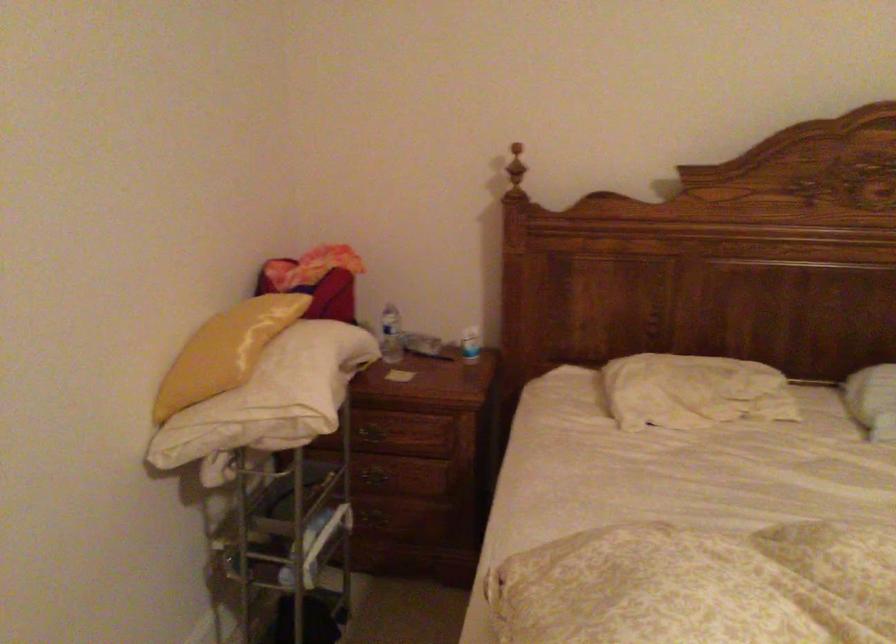
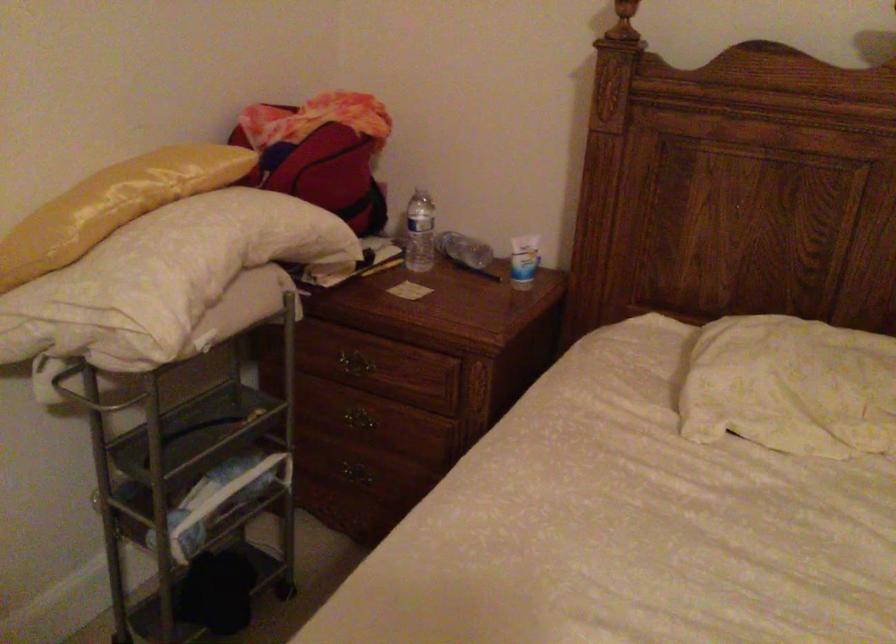
Find the pixel in the second image that matches (x=368, y=437) in the first image.

(350, 365)